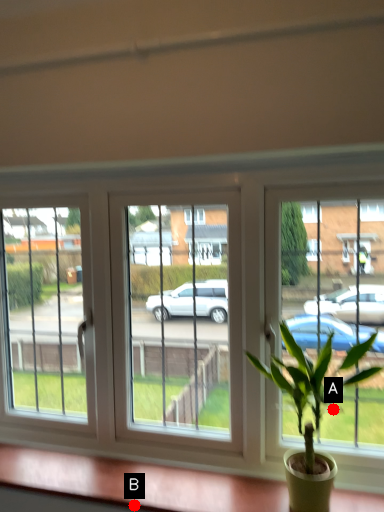
Question: Two points are circled on the image, labeled by A and B beside each circle. Which point is closer to the camera?

Choices:
 (A) A is closer
 (B) B is closer

Answer: (A)